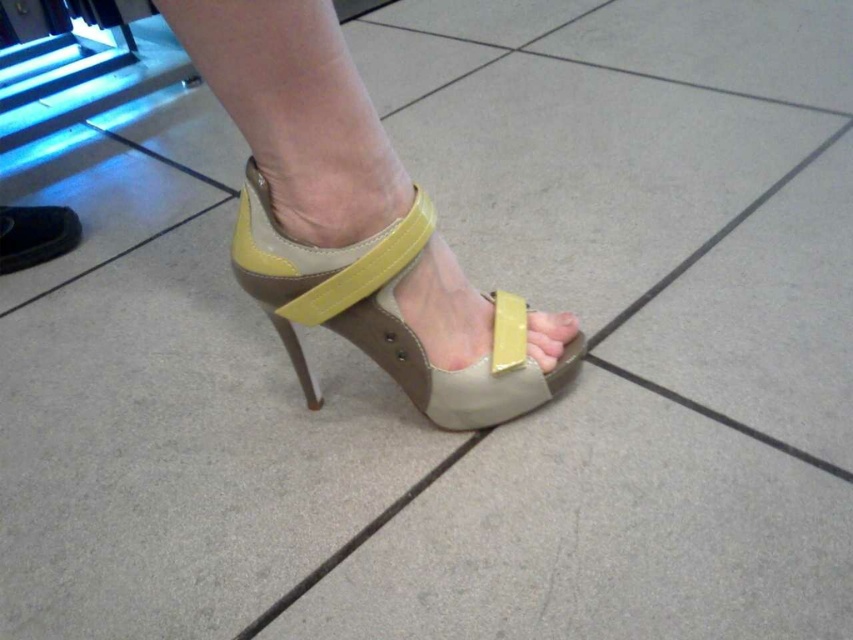
Does matte beige leather sandal at center have a greater height compared to matte yellow leather high heel at lower center?

Yes, matte beige leather sandal at center is taller than matte yellow leather high heel at lower center.

Who is more distant from viewer, (x=524, y=387) or (x=27, y=236)?

Point (x=27, y=236)

Image resolution: width=853 pixels, height=640 pixels. What are the coordinates of `matte beige leather sandal at center` in the screenshot? It's located at coord(386,314).